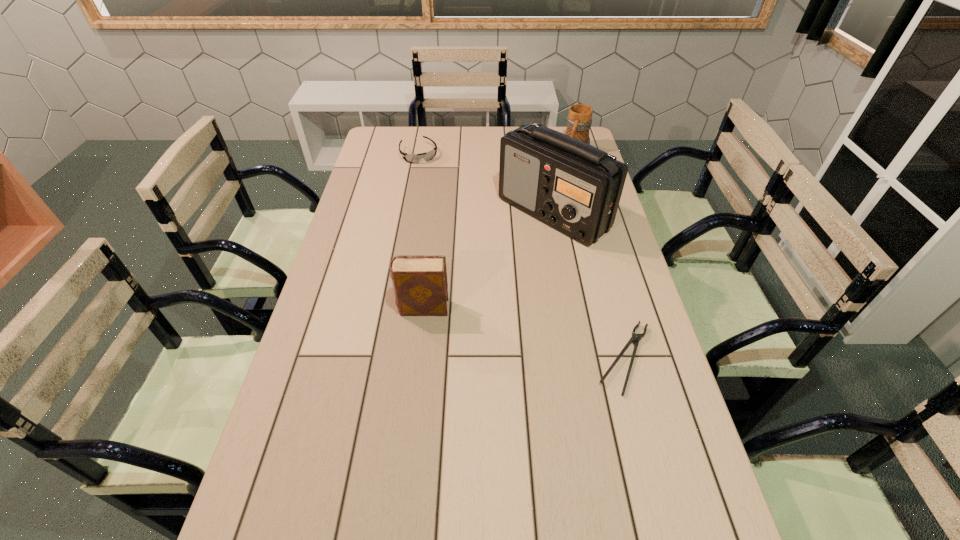
Locate an element on the screen. Image resolution: width=960 pixels, height=540 pixels. free spot located 0.070m on the left of the tongs is located at coordinates (565, 358).

Find the location of a particular element. The width and height of the screenshot is (960, 540). free space located 0.210m on the front panel of the third farthest object is located at coordinates (534, 294).

Where is `vacant space located on the front panel of the third farthest object`? Image resolution: width=960 pixels, height=540 pixels. vacant space located on the front panel of the third farthest object is located at coordinates click(x=531, y=307).

This screenshot has width=960, height=540. What are the coordinates of `free point located 0.150m on the front panel of the third farthest object` in the screenshot? It's located at (538, 280).

You are a GUI agent. You are given a task and a screenshot of the screen. Output one action in this format:
    pyautogui.click(x=<x>, y=<y>)
    Task: Click on the blank area located on the side of the mug with the handle
    Image resolution: width=960 pixels, height=540 pixels.
    Given the screenshot: What is the action you would take?
    tap(569, 168)

I want to click on free space located 0.360m on the side of the mug with the handle, so click(x=548, y=211).

In order to click on free space located 0.120m on the side of the mug with the handle in this screenshot , I will do pos(565,176).

This screenshot has width=960, height=540. In order to click on free spot located 0.210m on the lenses of the second shortest object in this screenshot , I will do `click(440, 192)`.

This screenshot has height=540, width=960. Find the location of `vacant space located 0.280m on the lenses of the second shortest object`. vacant space located 0.280m on the lenses of the second shortest object is located at coordinates (446, 203).

Locate an element on the screen. This screenshot has height=540, width=960. free space located 0.390m on the lenses of the second shortest object is located at coordinates (456, 221).